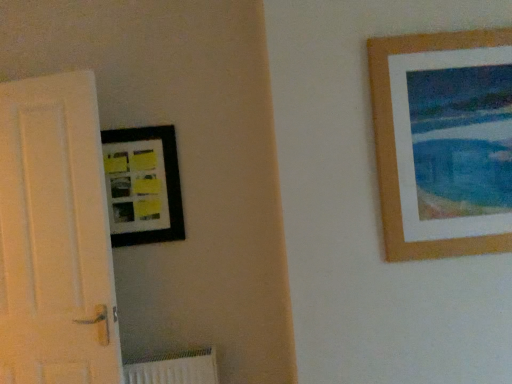
Question: Is point (384, 100) closer or farther from the camera than point (75, 187)?

Choices:
 (A) closer
 (B) farther

Answer: (A)

Question: Considering the positions of wooden picture frame at upper right, the 1th picture frame from the right, and white matte door at left in the image, is wooden picture frame at upper right, the 1th picture frame from the right, bigger or smaller than white matte door at left?

Choices:
 (A) small
 (B) big

Answer: (A)

Question: Which object is the farthest from the white matte door at left?

Choices:
 (A) wooden picture frame at upper right, arranged as the 2th picture frame when viewed from the left
 (B) matte black picture frame at upper left, arranged as the second picture frame when viewed from the front

Answer: (A)

Question: Which object is positioned closest to the white matte door at left?

Choices:
 (A) matte black picture frame at upper left, which is counted as the first picture frame, starting from the left
 (B) wooden picture frame at upper right, which is counted as the first picture frame, starting from the front

Answer: (A)